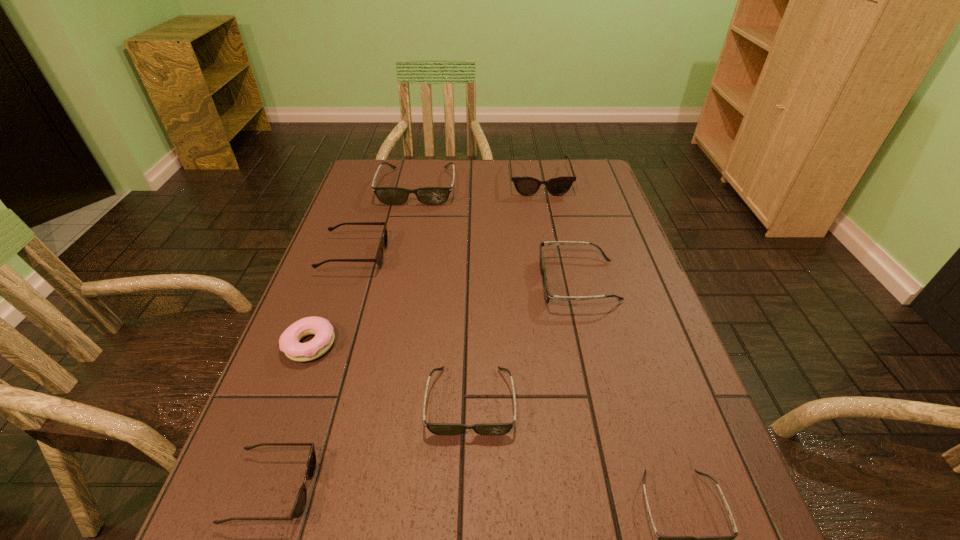
Find the location of `brown sunglasses that is the closest to the second farthest brown sunglasses`. brown sunglasses that is the closest to the second farthest brown sunglasses is located at coordinates (526, 186).

Locate which black sunglasses is the second closest to the smallest black sunglasses. Please provide its 2D coordinates. Your answer should be formatted as a tuple, i.e. [(x, y)], where the tuple contains the x and y coordinates of a point satisfying the conditions above.

[(548, 296)]

Identify the location of the third closest black sunglasses to the biggest black sunglasses. The height and width of the screenshot is (540, 960). pyautogui.click(x=662, y=539).

You are a GUI agent. You are given a task and a screenshot of the screen. Output one action in this format:
    pyautogui.click(x=<x>, y=<y>)
    Task: Click on the vacant point that satisfies the following two spatial constraints: 1. on the front lenses of the biggest brown sunglasses; 2. on the front lenses of the nearest brown sunglasses
    The height and width of the screenshot is (540, 960).
    Given the screenshot: What is the action you would take?
    pyautogui.click(x=599, y=489)

Find the location of a particular element. Image resolution: width=960 pixels, height=540 pixels. blank space that satisfies the following two spatial constraints: 1. on the front-facing side of the biggest black sunglasses; 2. on the front lenses of the second smallest brown sunglasses is located at coordinates (403, 255).